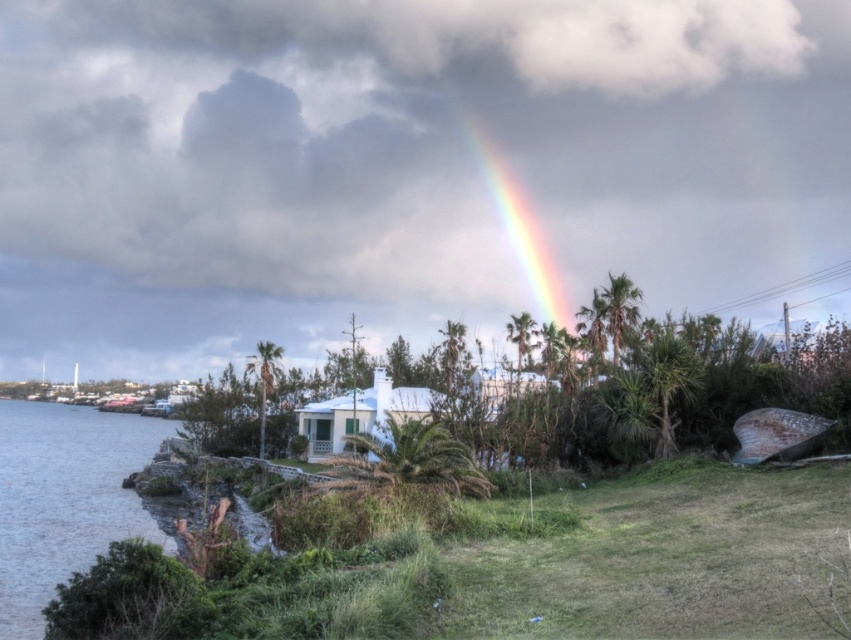
Between point (7, 529) and point (563, 314), which one is positioned in front?

Point (7, 529)

Does clear water at lower left have a greater width compared to rainbow at upper center?

Indeed, clear water at lower left has a greater width compared to rainbow at upper center.

Is point (64, 454) behind point (473, 122)?

No, (64, 454) is in front of (473, 122).

This screenshot has width=851, height=640. I want to click on clear water at lower left, so click(x=66, y=499).